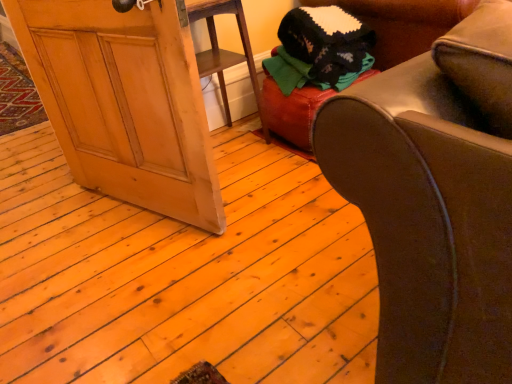
What is the approximate width of wooden screen door at lower left?

wooden screen door at lower left is 8.92 inches in width.

In order to click on leather ottoman at center in this screenshot , I will do `click(291, 113)`.

Is knitted wool sweater at upper right behind leather ottoman at center?

No, it is not.

Is knitted wool sweater at upper right next to leather ottoman at center and touching it?

No, knitted wool sweater at upper right is not in contact with leather ottoman at center.

Is knitted wool sweater at upper right positioned with its back to leather ottoman at center?

No, knitted wool sweater at upper right is not facing away from leather ottoman at center.

Would you say knitted wool sweater at upper right is inside or outside leather ottoman at center?

knitted wool sweater at upper right cannot be found inside leather ottoman at center.

From a real-world perspective, is knitted wool sweater at upper right on top of wooden screen door at lower left?

No.

From the image's perspective, would you say knitted wool sweater at upper right is shown under wooden screen door at lower left?

No.

Is knitted wool sweater at upper right looking in the opposite direction of wooden screen door at lower left?

That's not correct — knitted wool sweater at upper right is not looking away from wooden screen door at lower left.

Is knitted wool sweater at upper right not inside wooden screen door at lower left?

knitted wool sweater at upper right is positioned outside wooden screen door at lower left.

Consider the image. Which is in front, leather ottoman at center or knitted wool sweater at upper right?

knitted wool sweater at upper right is more forward.

From the image's perspective, is leather ottoman at center above or below knitted wool sweater at upper right?

Clearly, from the image's perspective, leather ottoman at center is below knitted wool sweater at upper right.

You are a GUI agent. You are given a task and a screenshot of the screen. Output one action in this format:
    pyautogui.click(x=<x>, y=<y>)
    Task: Click on the clothing on the left of the leather ottoman at center
    The image size is (512, 384).
    Given the screenshot: What is the action you would take?
    pyautogui.click(x=320, y=49)

Considering the relative sizes of leather ottoman at center and wooden screen door at lower left in the image provided, is leather ottoman at center bigger than wooden screen door at lower left?

Actually, leather ottoman at center might be smaller than wooden screen door at lower left.

Identify the location of stool above the wooden screen door at lower left (from the image's perspective). (291, 113).

Would you say leather ottoman at center is outside wooden screen door at lower left?

Yes.

Can you tell me how much leather ottoman at center and wooden screen door at lower left differ in facing direction?

The facing directions of leather ottoman at center and wooden screen door at lower left are 71.5 degrees apart.

Does wooden screen door at lower left have a greater height compared to leather ottoman at center?

Correct, wooden screen door at lower left is much taller as leather ottoman at center.

Is point (169, 181) less distant than point (296, 102)?

Yes.

Which is correct: wooden screen door at lower left is inside leather ottoman at center, or outside of it?

wooden screen door at lower left is spatially situated outside leather ottoman at center.

In the scene shown: Would you consider wooden screen door at lower left to be distant from leather ottoman at center?

They are positioned close to each other.

Can you confirm if wooden screen door at lower left is thinner than knitted wool sweater at upper right?

Yes.

I want to click on clothing that appears below the wooden screen door at lower left (from a real-world perspective), so click(320, 49).

From a real-world perspective, who is located higher, wooden screen door at lower left or knitted wool sweater at upper right?

wooden screen door at lower left is physically above.

Looking at this image, which is less distant, (x=85, y=116) or (x=322, y=6)?

Clearly, point (x=85, y=116) is closer to the camera than point (x=322, y=6).

The height and width of the screenshot is (384, 512). I want to click on clothing above the leather ottoman at center (from a real-world perspective), so click(320, 49).

Find the location of a particular element. clothing above the wooden screen door at lower left (from the image's perspective) is located at coordinates (320, 49).

Which object lies nearer to the anchor point leather ottoman at center, knitted wool sweater at upper right or wooden screen door at lower left?

knitted wool sweater at upper right is positioned closer to the anchor leather ottoman at center.

Based on their spatial positions, is leather ottoman at center or knitted wool sweater at upper right further from wooden screen door at lower left?

Based on the image, knitted wool sweater at upper right appears to be further to wooden screen door at lower left.

Which object lies further to the anchor point wooden screen door at lower left, knitted wool sweater at upper right or leather ottoman at center?

knitted wool sweater at upper right is positioned further to the anchor wooden screen door at lower left.

From the image, which object appears to be farther from leather ottoman at center, wooden screen door at lower left or knitted wool sweater at upper right?

wooden screen door at lower left is further to leather ottoman at center.

When comparing their distances from knitted wool sweater at upper right, does wooden screen door at lower left or leather ottoman at center seem closer?

leather ottoman at center.

From the image, which object appears to be farther from knitted wool sweater at upper right, leather ottoman at center or wooden screen door at lower left?

wooden screen door at lower left.

You are a GUI agent. You are given a task and a screenshot of the screen. Output one action in this format:
    pyautogui.click(x=<x>, y=<y>)
    Task: Click on the clothing located between wooden screen door at lower left and leather ottoman at center in the left-right direction
    The height and width of the screenshot is (384, 512).
    Given the screenshot: What is the action you would take?
    pyautogui.click(x=320, y=49)